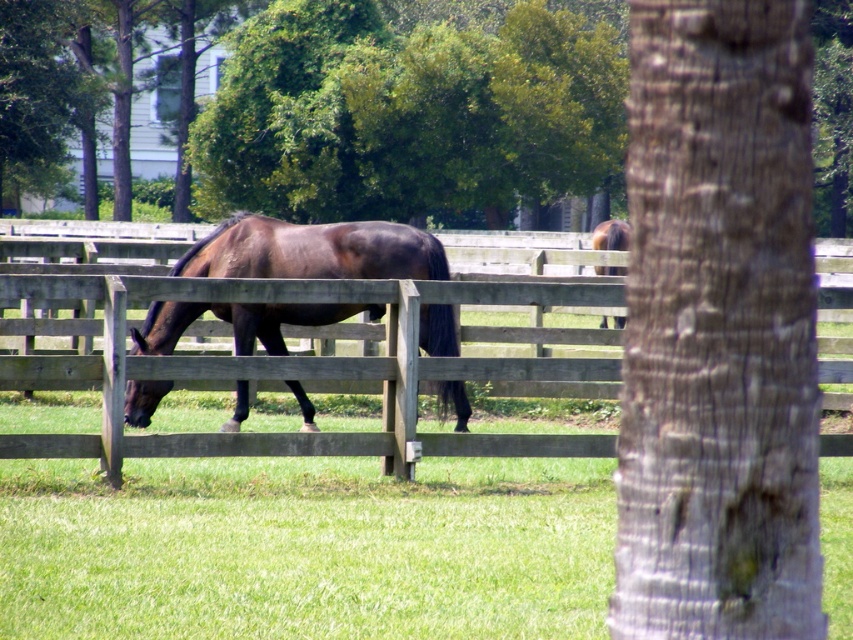
Question: Does green leafy tree at upper center have a greater width compared to shiny brown horse at center?

Choices:
 (A) yes
 (B) no

Answer: (A)

Question: Which point is farther to the camera?

Choices:
 (A) wooden fence at center
 (B) green leafy tree at upper center

Answer: (B)

Question: Does shiny brown horse at center have a greater width compared to brown glossy horse at upper right?

Choices:
 (A) no
 (B) yes

Answer: (A)

Question: Among these points, which one is farthest from the camera?

Choices:
 (A) (631, 337)
 (B) (335, 440)
 (C) (393, 250)

Answer: (A)

Question: Is gray textured bark at center right bigger than shiny brown horse at center?

Choices:
 (A) no
 (B) yes

Answer: (B)

Question: Which of the following is the farthest from the observer?

Choices:
 (A) gray textured bark at center right
 (B) brown glossy horse at upper right
 (C) green leafy tree at upper center
 (D) shiny brown horse at center

Answer: (C)